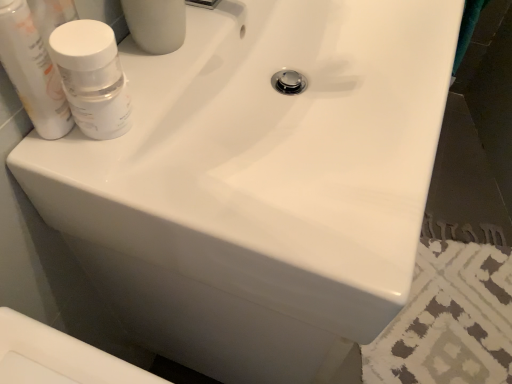
Where is `free space in front of white matte bottle at upper left, which is counted as the 1th mouthwash, starting from the right`? Image resolution: width=512 pixels, height=384 pixels. free space in front of white matte bottle at upper left, which is counted as the 1th mouthwash, starting from the right is located at coordinates (118, 184).